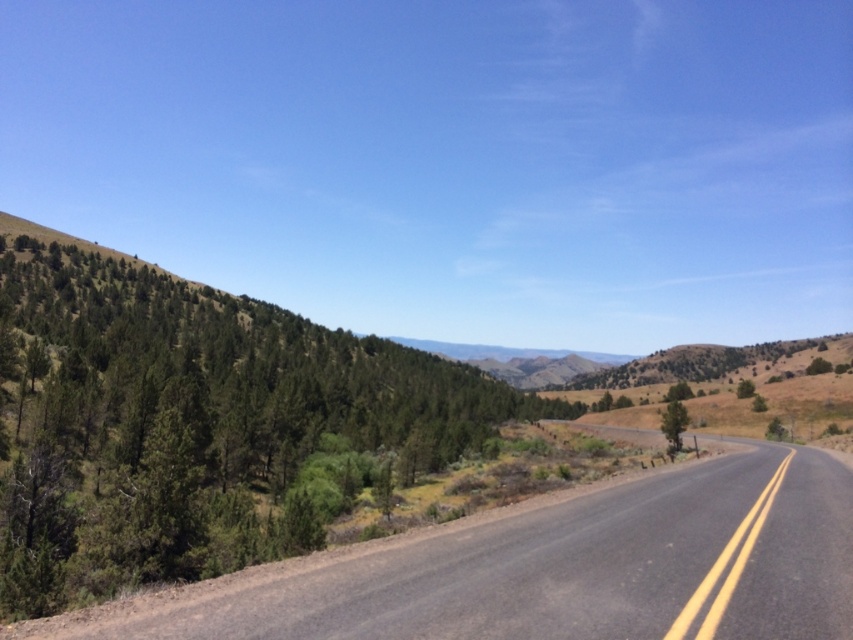
You are standing at the center of the road and looking towards the green leafy tree at left. Based on the 2D coordinates provided, in which direction relative to your position should you look to see the tree?

The green leafy tree at left is located at coordinates 2D point [196,424]. Since you are at the center of the road, the tree is to your left side.